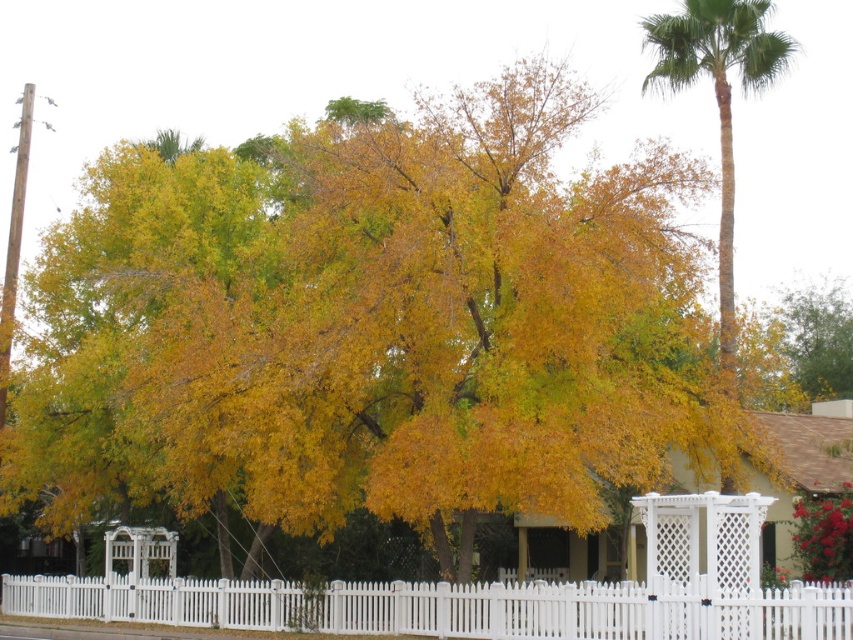
Is white picket fence at center smaller than green leafy palm at upper right?

Yes.

Who is more forward, (227, 604) or (772, 61)?

Point (227, 604) is more forward.

Is point (61, 612) farther from viewer compared to point (723, 106)?

Yes, it is behind point (723, 106).

You are a GUI agent. You are given a task and a screenshot of the screen. Output one action in this format:
    pyautogui.click(x=<x>, y=<y>)
    Task: Click on the white picket fence at center
    
    Given the screenshot: What is the action you would take?
    pyautogui.click(x=447, y=605)